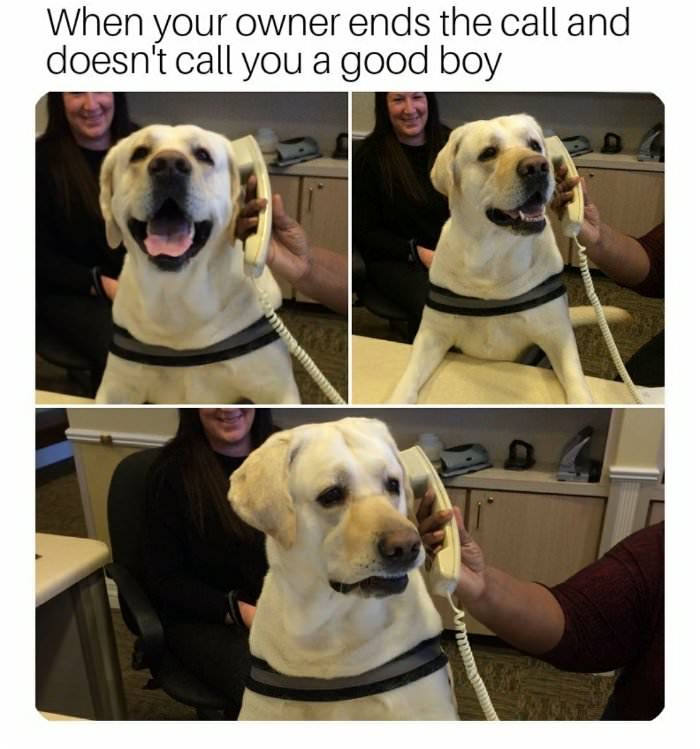
You are a GUI agent. You are given a task and a screenshot of the screen. Output one action in this format:
    pyautogui.click(x=<x>, y=<y>)
    Task: Click on the office chair
    Image resolution: width=700 pixels, height=749 pixels.
    Given the screenshot: What is the action you would take?
    pyautogui.click(x=189, y=685)